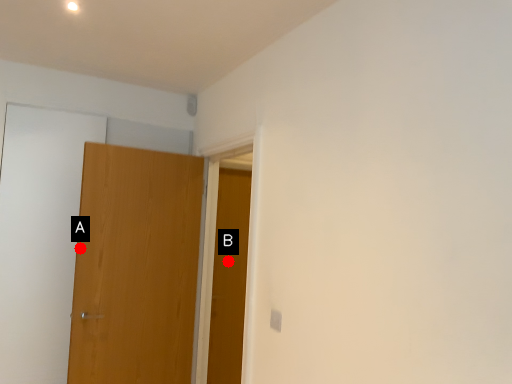
Question: Two points are circled on the image, labeled by A and B beside each circle. Which of the following is the closest to the observer?

Choices:
 (A) A is closer
 (B) B is closer

Answer: (A)